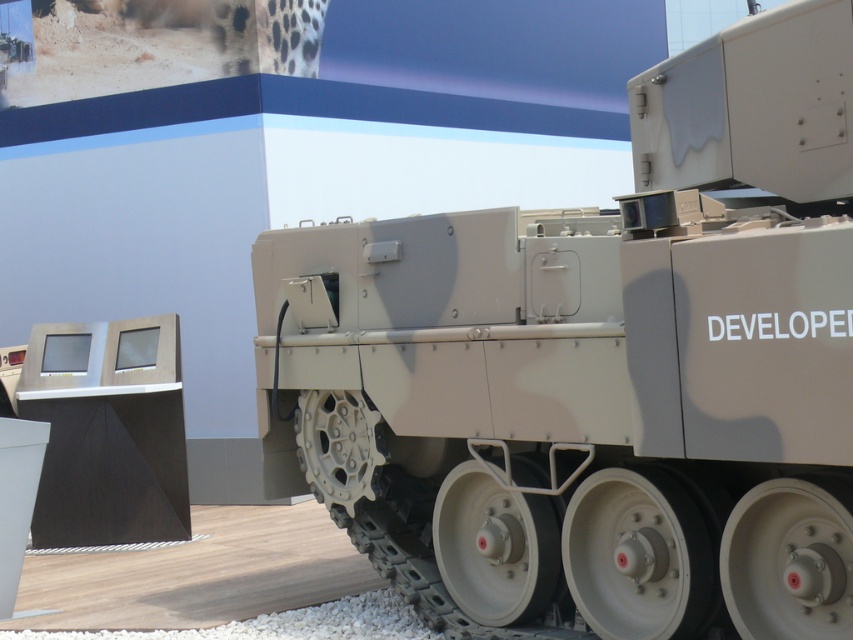
Between camouflage paint tank at center and black matte monitor at lower left, which one is positioned lower?

black matte monitor at lower left

Does camouflage paint tank at center come behind black matte monitor at lower left?

No, it is in front of black matte monitor at lower left.

Which is behind, point (492, 538) or point (142, 349)?

Positioned behind is point (142, 349).

Where is `camouflage paint tank at center`? This screenshot has width=853, height=640. camouflage paint tank at center is located at coordinates (602, 369).